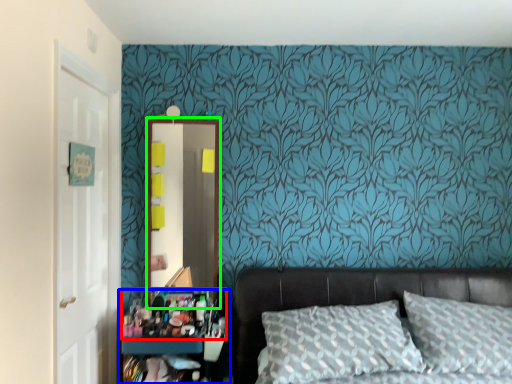
Question: Estimate the real-world distances between objects in this image. Which object is farther from stuff (highlighted by a red box), dresser (highlighted by a blue box) or mirror (highlighted by a green box)?

Choices:
 (A) dresser
 (B) mirror

Answer: (B)